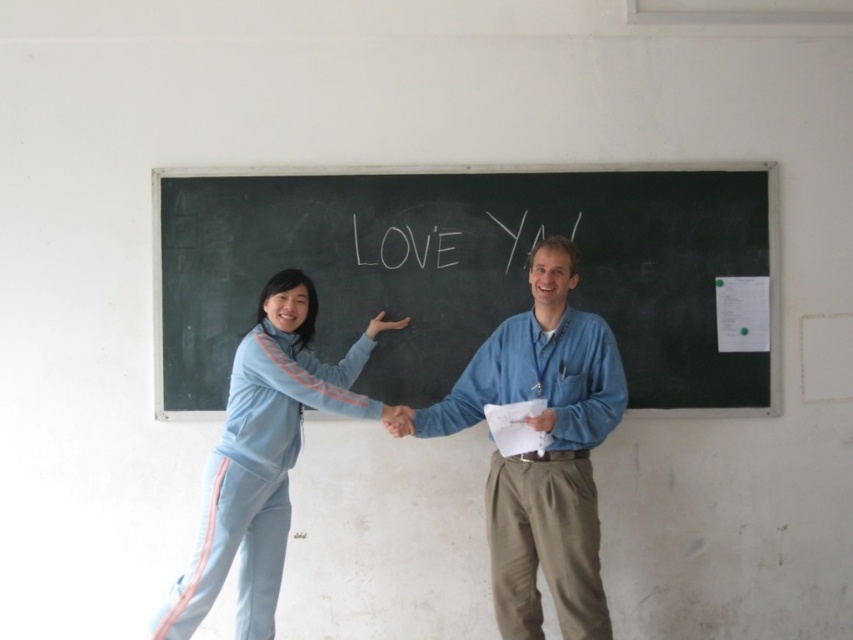
Between blue denim shirt at center and light blue fabric pants at left, which one appears on the right side from the viewer's perspective?

blue denim shirt at center is more to the right.

Where is `blue denim shirt at center`? Image resolution: width=853 pixels, height=640 pixels. blue denim shirt at center is located at coordinates (544, 451).

Is point (550, 310) positioned before point (258, 410)?

No, (550, 310) is behind (258, 410).

Find the location of `blue denim shirt at center`. blue denim shirt at center is located at coordinates (544, 451).

From the picture: Does white paper at center have a greater width compared to blue denim shirt at center?

Yes.

Between white paper at center and blue denim shirt at center, which one appears on the left side from the viewer's perspective?

From the viewer's perspective, white paper at center appears more on the left side.

You are a GUI agent. You are given a task and a screenshot of the screen. Output one action in this format:
    pyautogui.click(x=<x>, y=<y>)
    Task: Click on the white paper at center
    
    Given the screenshot: What is the action you would take?
    pyautogui.click(x=474, y=273)

The width and height of the screenshot is (853, 640). I want to click on white paper at center, so click(x=474, y=273).

At what (x,y) coordinates should I click in order to perform the action: click on white paper at center. Please return your answer as a coordinate pair (x, y). Looking at the image, I should click on (474, 273).